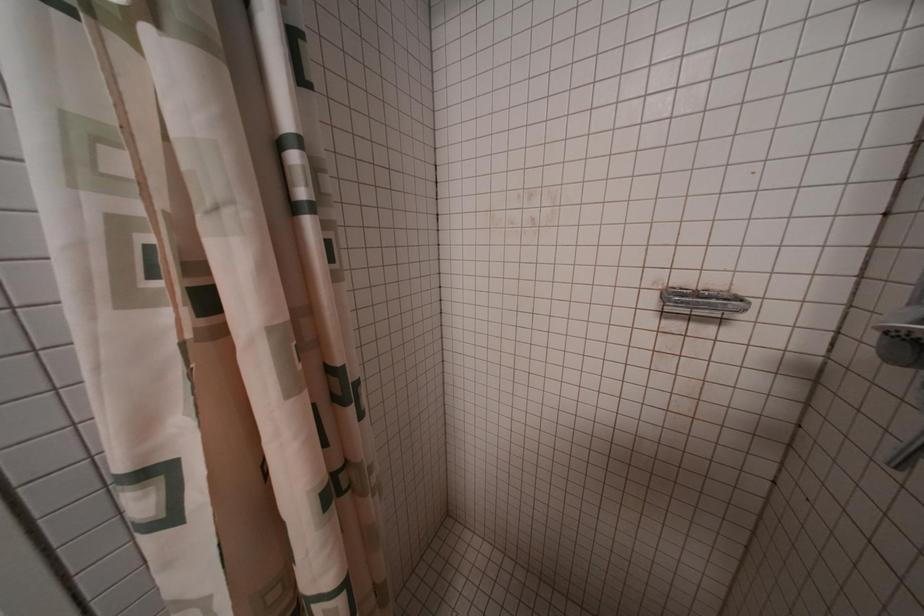
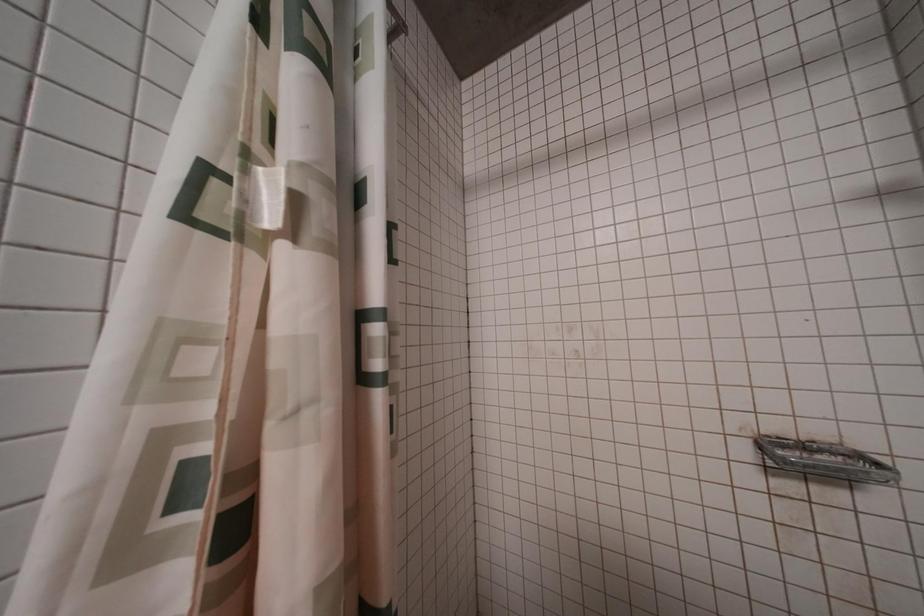
Question: The first image is from the beginning of the video and the second image is from the end. How did the camera likely rotate when shooting the video?

Choices:
 (A) Left
 (B) Right
 (C) Up
 (D) Down

Answer: (C)